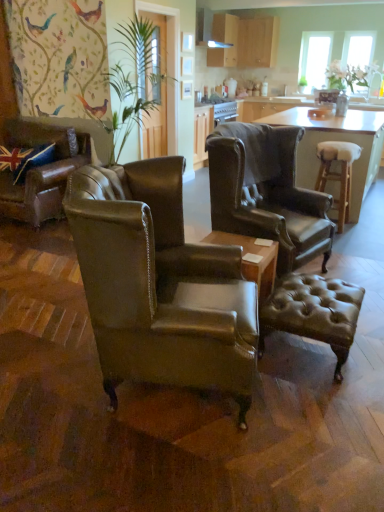
Question: Is wooden bar stool at right taller or shorter than brown leather ottoman at center?

Choices:
 (A) tall
 (B) short

Answer: (A)

Question: Considering the positions of wooden bar stool at right and brown leather ottoman at center in the image, is wooden bar stool at right bigger or smaller than brown leather ottoman at center?

Choices:
 (A) big
 (B) small

Answer: (A)

Question: Which object is the farthest from the clear glass door at upper center?

Choices:
 (A) leather wingback chair at center, which is the third chair from left to right
 (B) leather wingback chair at center, the third chair when ordered from back to front
 (C) transparent glass window at upper right, the first window screen when ordered from left to right
 (D) leather wingback chair at left, the first chair from the left
 (E) translucent glass window at upper right, the second window screen from the left

Answer: (B)

Question: Which of these objects is positioned closest to the leather wingback chair at center, which is the third chair from left to right?

Choices:
 (A) matte wood cabinets at upper center, arranged as the 2th cabinetry when viewed from the right
 (B) matte wood exhaust hood at upper center
 (C) transparent glass window at upper right, placed as the 2th window screen when sorted from right to left
 (D) wooden bar stool at right
 (E) leather wingback chair at left, which ranks as the 3th chair in front-to-back order

Answer: (D)